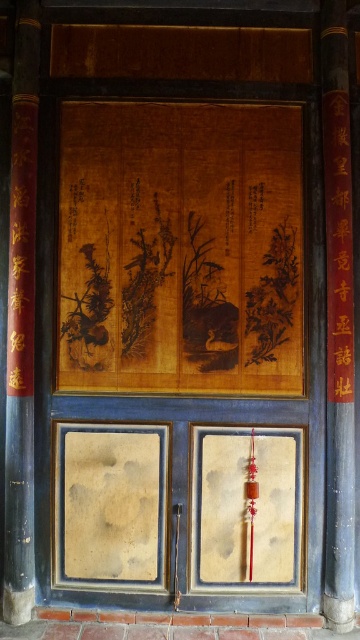
Based on the photo, you are standing in front of the traditional wooden door described. There is a point marked at coordinate (338, 321). What object is located at that point?

The point at coordinate (338, 321) indicates the location of the black wood pillar at right.